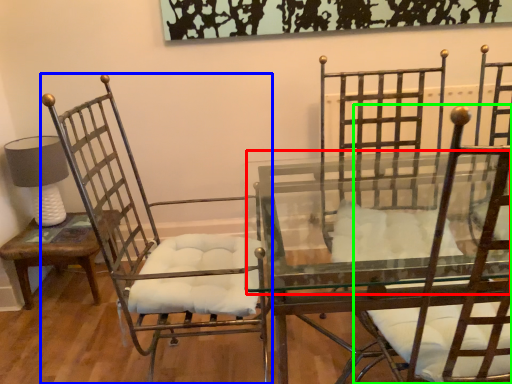
Question: Which object is positioned closest to round table (highlighted by a red box)? Select from chair (highlighted by a blue box) and chair (highlighted by a green box).

Choices:
 (A) chair
 (B) chair

Answer: (A)